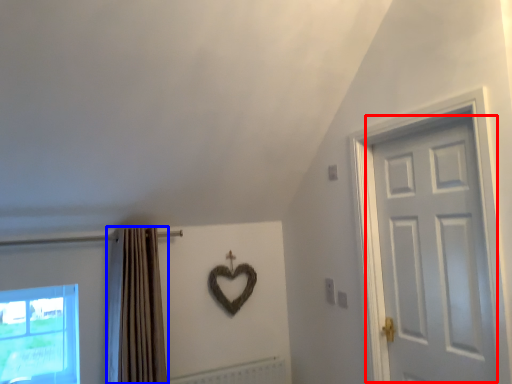
Question: Which of the following is the farthest to the observer, door (highlighted by a red box) or curtain (highlighted by a blue box)?

Choices:
 (A) door
 (B) curtain

Answer: (B)